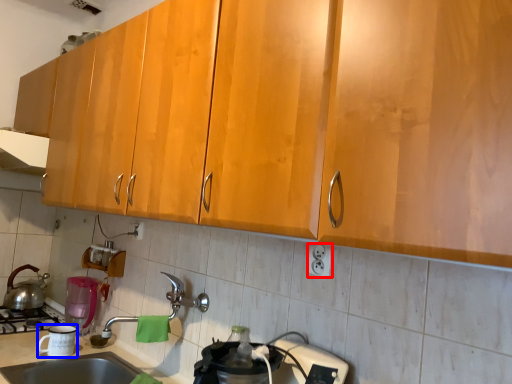
Question: Which object appears farthest to the camera in this image, electric outlet (highlighted by a red box) or appliance (highlighted by a blue box)?

Choices:
 (A) electric outlet
 (B) appliance

Answer: (B)